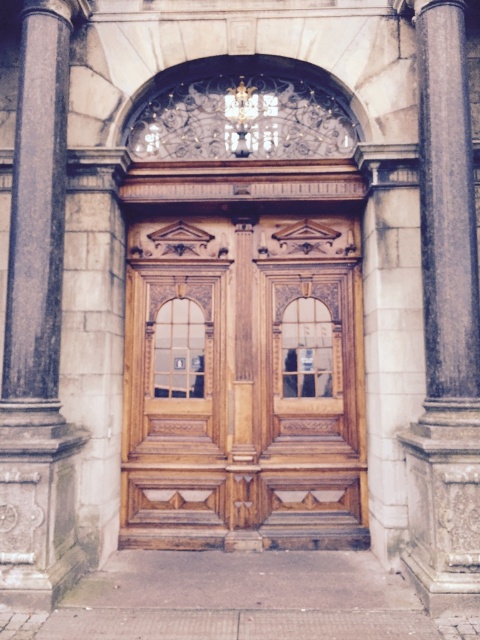
You are standing at the entrance of the historic building and need to locate the dark gray stone pillar at left. According to the coordinates provided, where exactly is it positioned?

The dark gray stone pillar at left is positioned at point 0.512 on the x axis and 0.079 on the y axis.

You are standing at the entrance of the historic building and need to move a 6.0 feet wide delivery cart through the space between the wooden door at center and the brown polished stone column at right. Can the cart fit through the space?

The wooden door at center is 5.80 feet away from the brown polished stone column at right. Since the cart is 6.0 feet wide, it is slightly wider than the available space, so the cart cannot fit through the space between the wooden door at center and the brown polished stone column at right.